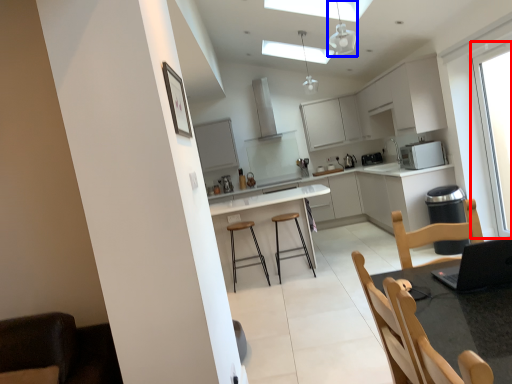
Question: Which object appears closest to the camera in this image, window (highlighted by a red box) or light fixture (highlighted by a blue box)?

Choices:
 (A) window
 (B) light fixture

Answer: (B)